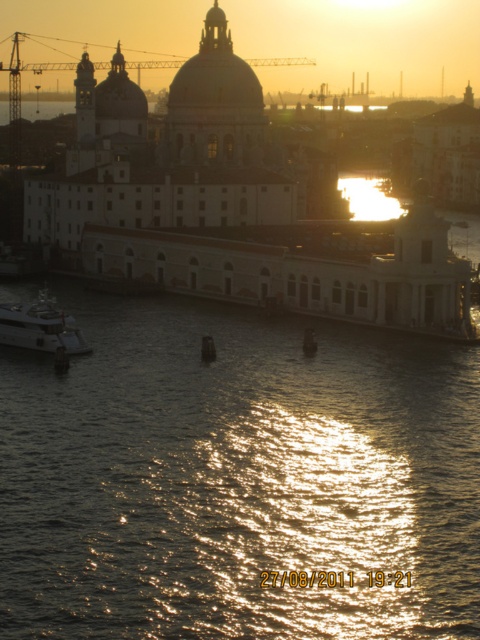
Question: Is shiny reflective water at lower center thinner than shiny silver yacht at lower left?

Choices:
 (A) yes
 (B) no

Answer: (B)

Question: Can you confirm if shiny reflective water at lower center is positioned to the left of shiny silver yacht at lower left?

Choices:
 (A) no
 (B) yes

Answer: (A)

Question: Among these objects, which one is nearest to the camera?

Choices:
 (A) shiny silver yacht at lower left
 (B) shiny reflective water at lower center

Answer: (B)

Question: Is shiny reflective water at lower center bigger than shiny silver yacht at lower left?

Choices:
 (A) yes
 (B) no

Answer: (A)

Question: Which point is farther to the camera?

Choices:
 (A) (27, 336)
 (B) (122, 564)

Answer: (A)

Question: Among these points, which one is farthest from the camera?

Choices:
 (A) (354, 592)
 (B) (11, 324)

Answer: (B)